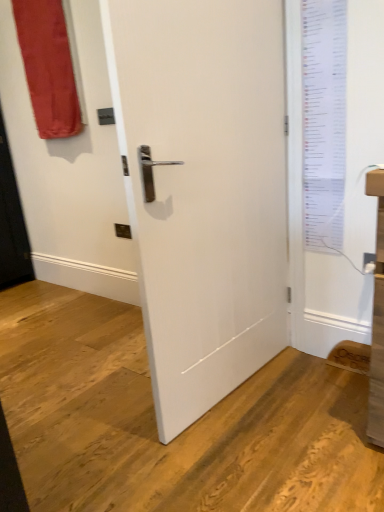
Question: Considering the relative sizes of matte red curtain at upper left and white paper list at upper right in the image provided, is matte red curtain at upper left shorter than white paper list at upper right?

Choices:
 (A) yes
 (B) no

Answer: (A)

Question: Considering the relative sizes of matte red curtain at upper left and white paper list at upper right in the image provided, is matte red curtain at upper left smaller than white paper list at upper right?

Choices:
 (A) no
 (B) yes

Answer: (A)

Question: From the image's perspective, is matte red curtain at upper left located beneath white paper list at upper right?

Choices:
 (A) yes
 (B) no

Answer: (B)

Question: Is matte red curtain at upper left aimed at white paper list at upper right?

Choices:
 (A) yes
 (B) no

Answer: (B)

Question: Is matte red curtain at upper left located outside white paper list at upper right?

Choices:
 (A) yes
 (B) no

Answer: (A)

Question: From the image's perspective, relative to matte red curtain at upper left, is white paper list at upper right above or below?

Choices:
 (A) below
 (B) above

Answer: (A)

Question: From a real-world perspective, is white paper list at upper right above or below matte red curtain at upper left?

Choices:
 (A) below
 (B) above

Answer: (A)

Question: Considering the positions of white paper list at upper right and matte red curtain at upper left in the image, is white paper list at upper right wider or thinner than matte red curtain at upper left?

Choices:
 (A) thin
 (B) wide

Answer: (A)

Question: Is white paper list at upper right in front of or behind matte red curtain at upper left in the image?

Choices:
 (A) front
 (B) behind

Answer: (A)

Question: From their relative heights in the image, would you say matte red curtain at upper left is taller or shorter than white paper list at upper right?

Choices:
 (A) short
 (B) tall

Answer: (A)

Question: Considering the positions of matte red curtain at upper left and white paper list at upper right in the image, is matte red curtain at upper left bigger or smaller than white paper list at upper right?

Choices:
 (A) big
 (B) small

Answer: (A)

Question: Considering their positions, is matte red curtain at upper left located in front of or behind white paper list at upper right?

Choices:
 (A) behind
 (B) front

Answer: (A)

Question: Considering the positions of point (59, 54) and point (327, 76), is point (59, 54) closer or farther from the camera than point (327, 76)?

Choices:
 (A) farther
 (B) closer

Answer: (A)

Question: Looking at the image, does white paper list at upper right seem bigger or smaller compared to white matte door at center?

Choices:
 (A) small
 (B) big

Answer: (A)

Question: Considering the relative positions of white paper list at upper right and white matte door at center in the image provided, is white paper list at upper right to the left or to the right of white matte door at center?

Choices:
 (A) right
 (B) left

Answer: (A)